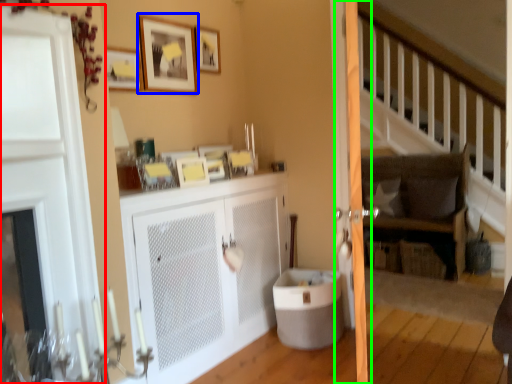
Question: Which object is positioned farthest from door (highlighted by a red box)? Select from picture frame (highlighted by a blue box) and screen door (highlighted by a green box).

Choices:
 (A) picture frame
 (B) screen door

Answer: (B)